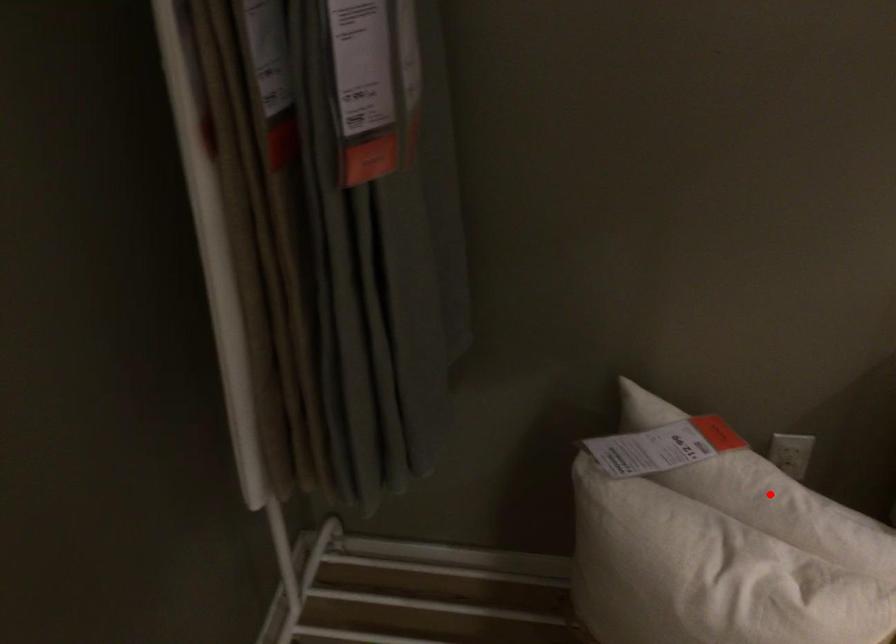
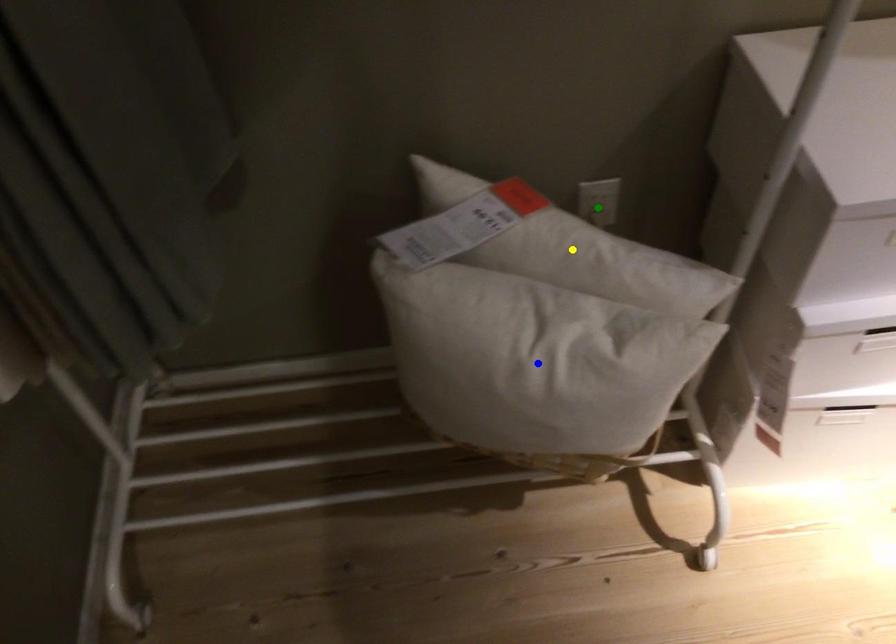
Question: I am providing you with two images of the same scene from different viewpoints. A red point is marked on the first image. You are given multiple points on the second image. Which mark in image 2 goes with the point in image 1?

Choices:
 (A) green point
 (B) yellow point
 (C) blue point

Answer: (B)